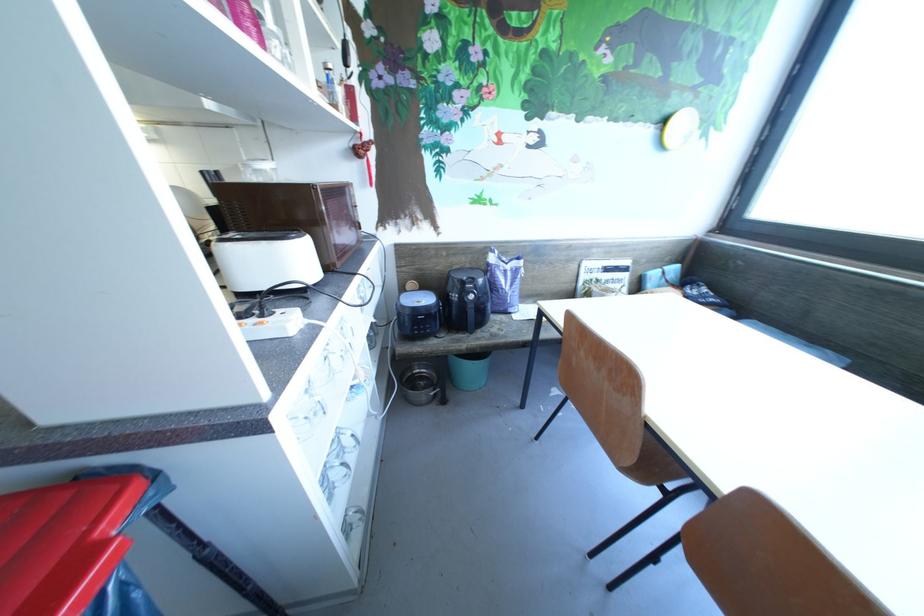
Which object does [504,281] point to?

It corresponds to the purple food bag in the image.